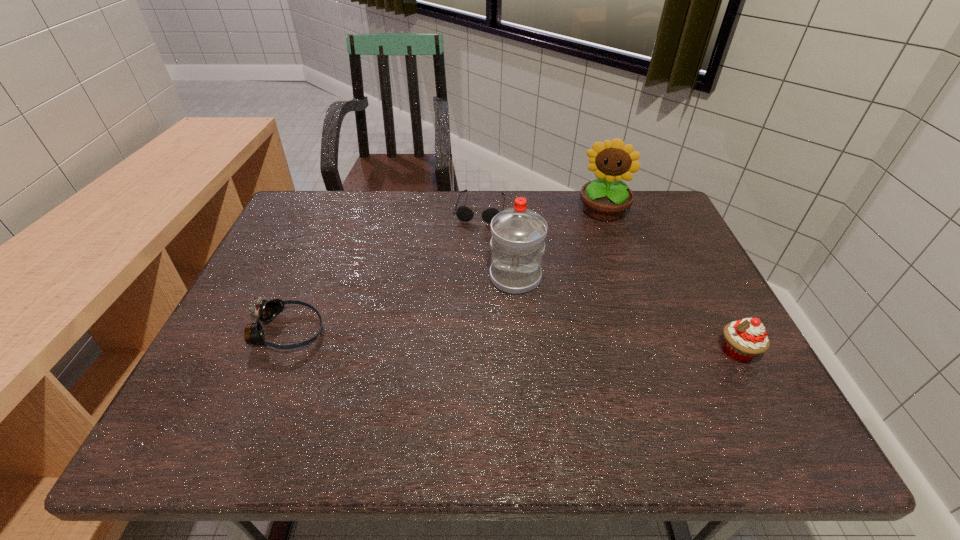
Point out which object is positioned as the second nearest to the cupcake. Please provide its 2D coordinates. Your answer should be formatted as a tuple, i.e. [(x, y)], where the tuple contains the x and y coordinates of a point satisfying the conditions above.

[(606, 199)]

The image size is (960, 540). I want to click on free space that satisfies the following two spatial constraints: 1. on the front side of the sunglasses; 2. on the right side of the cupcake, so click(x=480, y=352).